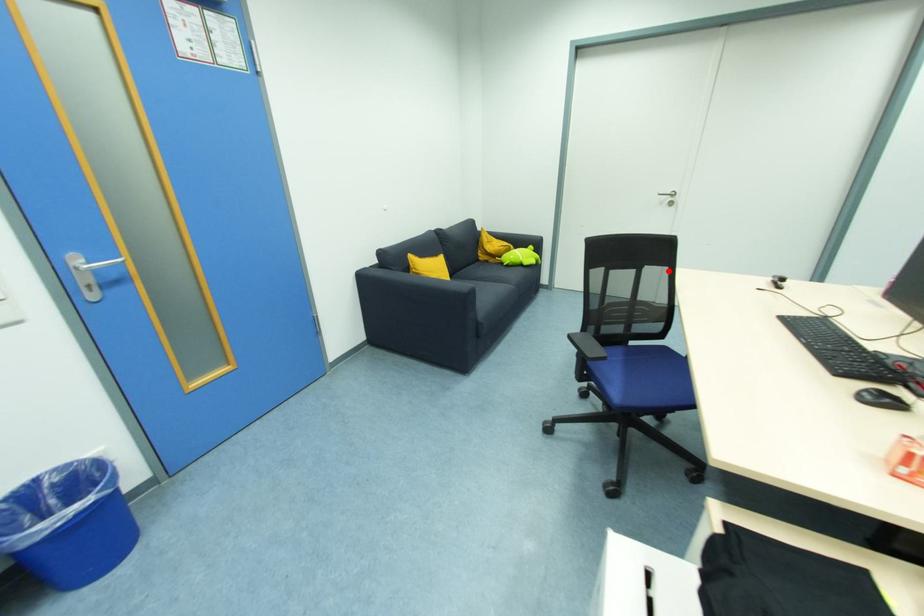
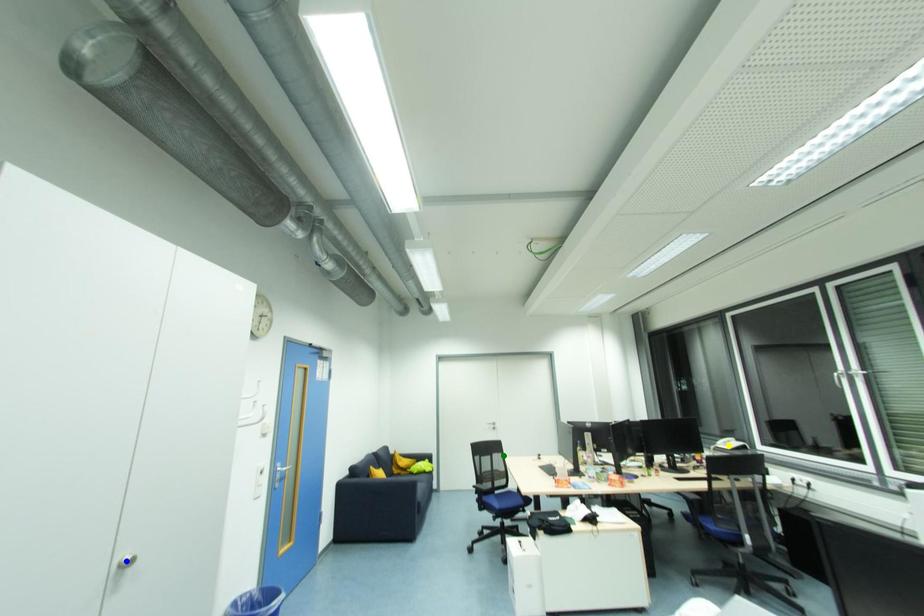
Question: I am providing you with two images of the same scene from different viewpoints. A red point is marked on the first image. You are given multiple points on the second image. Which point in image 2 represents the same 3d spot as the red point in image 1?

Choices:
 (A) green point
 (B) blue point
 (C) yellow point

Answer: (A)